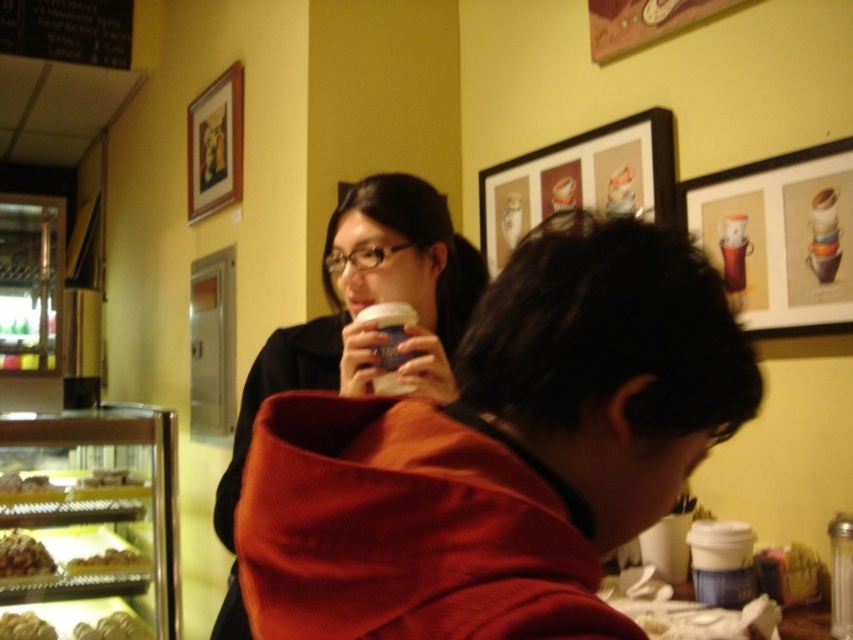
Can you confirm if matte black coffee cup at upper center is positioned to the right of smooth white cake at left?

Indeed, matte black coffee cup at upper center is positioned on the right side of smooth white cake at left.

Which is above, matte black coffee cup at upper center or smooth white cake at left?

matte black coffee cup at upper center

In order to click on matte black coffee cup at upper center in this screenshot , I will do `click(364, 305)`.

Based on the photo, who is positioned more to the left, wooden frame at upper center or matte plastic cup at upper center?

From the viewer's perspective, wooden frame at upper center appears more on the left side.

Describe the element at coordinates (215, 145) in the screenshot. I see `wooden frame at upper center` at that location.

Between point (200, 204) and point (381, 360), which one is positioned behind?

Positioned behind is point (200, 204).

Identify the location of wooden frame at upper center. (215, 145).

How distant is crumbly brown pastry at lower left from smooth white cake at left?

crumbly brown pastry at lower left is 10.48 inches away from smooth white cake at left.

In the scene shown: Is crumbly brown pastry at lower left shorter than smooth white cake at left?

In fact, crumbly brown pastry at lower left may be taller than smooth white cake at left.

Where is `crumbly brown pastry at lower left`? The image size is (853, 640). crumbly brown pastry at lower left is located at coordinates (22, 556).